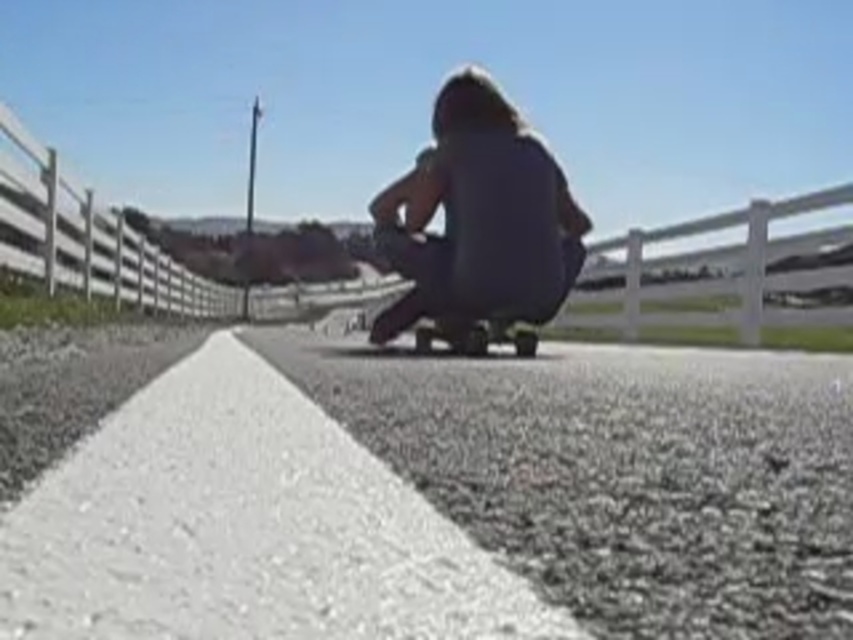
Question: Is matte gray hoodie at center thinner than white wooden fence at center?

Choices:
 (A) no
 (B) yes

Answer: (B)

Question: Can you confirm if matte gray hoodie at center is thinner than white wooden fence at center?

Choices:
 (A) yes
 (B) no

Answer: (A)

Question: Considering the real-world distances, which object is closest to the white wooden fence at center?

Choices:
 (A) matte gray hoodie at center
 (B) smooth black skateboard at center

Answer: (B)

Question: Among these points, which one is farthest from the camera?

Choices:
 (A) (550, 237)
 (B) (32, 150)

Answer: (B)

Question: Which object is closer to the camera taking this photo?

Choices:
 (A) white wooden fence at center
 (B) matte gray hoodie at center

Answer: (B)

Question: Can you confirm if matte gray hoodie at center is positioned below smooth black skateboard at center?

Choices:
 (A) no
 (B) yes

Answer: (A)